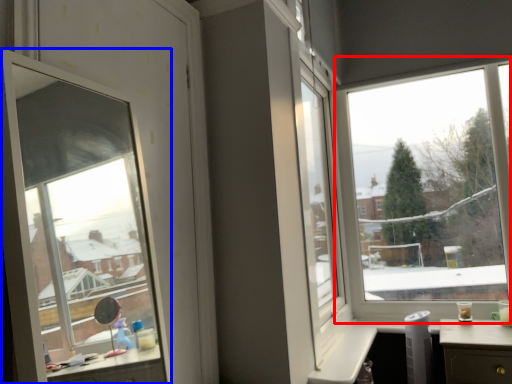
Question: Which point is further to the camera, window (highlighted by a red box) or window (highlighted by a blue box)?

Choices:
 (A) window
 (B) window

Answer: (A)